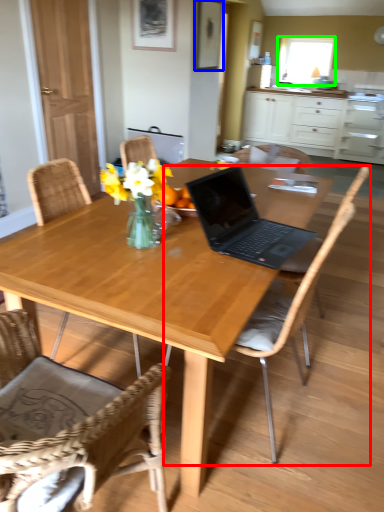
Question: Which object is the farthest from chair (highlighted by a red box)? Choose among these: picture frame (highlighted by a blue box) or window screen (highlighted by a green box).

Choices:
 (A) picture frame
 (B) window screen

Answer: (B)